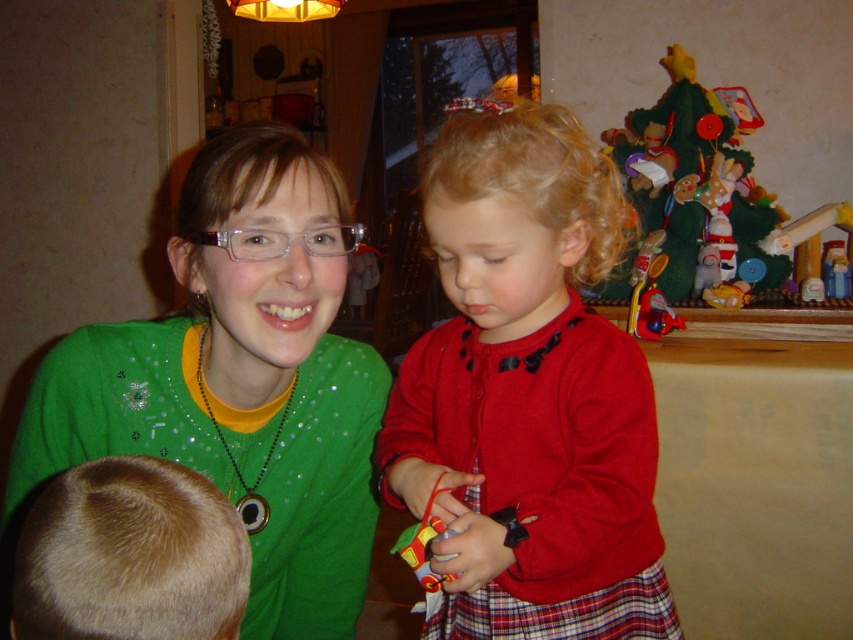
You are standing at the point with coordinates point (248, 228) and want to move towards the point with coordinates point (322, 412). According to the scene, will you be moving forward or backward?

Point (322, 412) is behind point (248, 228), so moving towards it would mean moving backward.

You are a photographer setting up for a family photo in this living room. You want to ensure the matte red sweater at center and the felt christmas tree at upper right are both visible in the shot. Based on their positions, which object might partially block the view of the other?

The matte red sweater at center is in front of the felt christmas tree at upper right, so it might partially block the view of the felt christmas tree at upper right.

You are a parent trying to place a 1.20 meter long ribbon between the green sparkly sweater at upper left and the felt christmas tree at upper right. Can the ribbon fit between them without bending?

The distance between the green sparkly sweater at upper left and the felt christmas tree at upper right is 1.30 meters, which is longer than the 1.20 meter ribbon. Therefore, the ribbon can fit between them without bending.